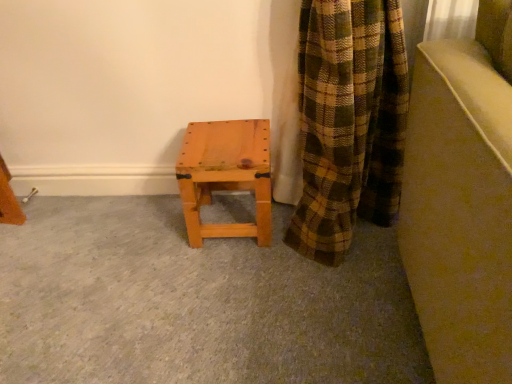
Where is `free space in front of natural wood stool at center`? The height and width of the screenshot is (384, 512). free space in front of natural wood stool at center is located at coordinates pyautogui.click(x=231, y=269).